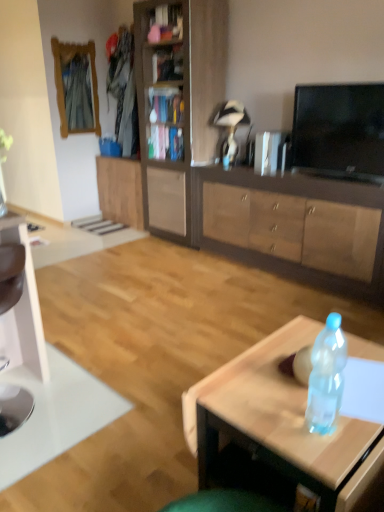
Question: Is translucent plastic bottle at center oriented away from wooden bookshelf at center?

Choices:
 (A) no
 (B) yes

Answer: (A)

Question: From the image's perspective, is translucent plastic bottle at center beneath wooden bookshelf at center?

Choices:
 (A) yes
 (B) no

Answer: (A)

Question: Is translucent plastic bottle at center closer to the viewer compared to wooden bookshelf at center?

Choices:
 (A) yes
 (B) no

Answer: (A)

Question: Is translucent plastic bottle at center smaller than wooden bookshelf at center?

Choices:
 (A) yes
 (B) no

Answer: (B)

Question: Can you confirm if translucent plastic bottle at center is positioned to the right of wooden bookshelf at center?

Choices:
 (A) no
 (B) yes

Answer: (B)

Question: From the image's perspective, is translucent plastic bottle at center over wooden bookshelf at center?

Choices:
 (A) yes
 (B) no

Answer: (B)

Question: Does translucent plastic bottle at center have a greater height compared to wooden frame mirror at upper left?

Choices:
 (A) yes
 (B) no

Answer: (B)

Question: From a real-world perspective, is translucent plastic bottle at center positioned under wooden frame mirror at upper left based on gravity?

Choices:
 (A) yes
 (B) no

Answer: (A)

Question: Are translucent plastic bottle at center and wooden frame mirror at upper left located far from each other?

Choices:
 (A) no
 (B) yes

Answer: (B)

Question: Can you confirm if translucent plastic bottle at center is wider than wooden frame mirror at upper left?

Choices:
 (A) no
 (B) yes

Answer: (B)

Question: Considering the relative sizes of translucent plastic bottle at center and wooden frame mirror at upper left in the image provided, is translucent plastic bottle at center shorter than wooden frame mirror at upper left?

Choices:
 (A) yes
 (B) no

Answer: (A)

Question: Is translucent plastic bottle at center beside wooden frame mirror at upper left?

Choices:
 (A) no
 (B) yes

Answer: (A)

Question: Is wooden bookshelf at upper center not inside white glossy computer desk at left?

Choices:
 (A) no
 (B) yes

Answer: (B)